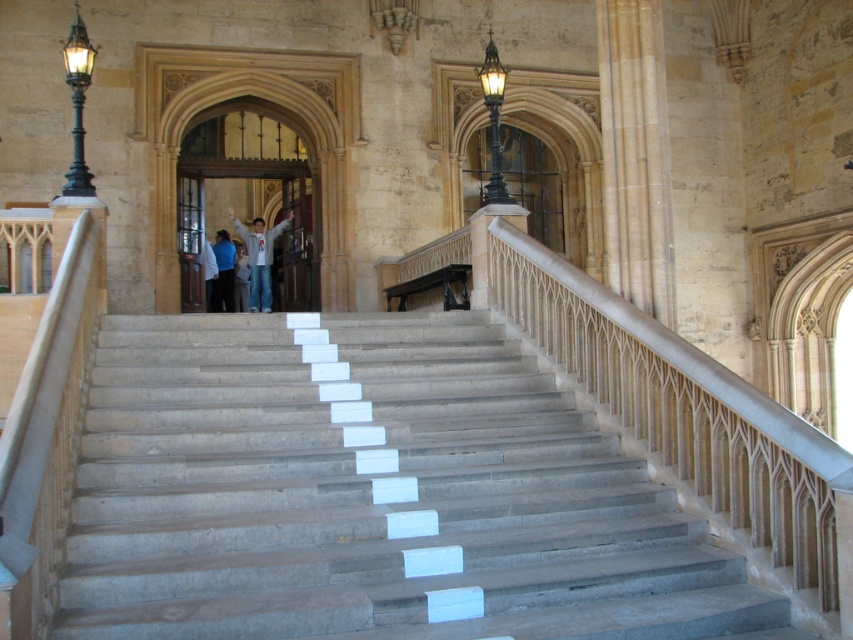
Between gray stone stairs at center and white cotton shirt at center, which one has less height?

gray stone stairs at center

How distant is gray stone stairs at center from white cotton shirt at center?

The distance of gray stone stairs at center from white cotton shirt at center is 63.31 feet.

This screenshot has height=640, width=853. What are the coordinates of `gray stone stairs at center` in the screenshot? It's located at (372, 493).

Does wooden balustrade at center have a greater height compared to blue shirt at center?

In fact, wooden balustrade at center may be shorter than blue shirt at center.

Between wooden balustrade at center and blue shirt at center, which one appears on the left side from the viewer's perspective?

Positioned to the left is blue shirt at center.

Does point (412, 289) lie behind point (224, 275)?

No, (412, 289) is closer to viewer.

Where is `wooden balustrade at center`? This screenshot has width=853, height=640. wooden balustrade at center is located at coordinates (433, 285).

From the picture: Is gray stone stairs at center above wooden balustrade at center?

No.

Which is in front, point (374, 444) or point (463, 292)?

Positioned in front is point (374, 444).

Does point (535, 528) come closer to viewer compared to point (448, 273)?

Yes, it is in front of point (448, 273).

At what (x,y) coordinates should I click in order to perform the action: click on gray stone stairs at center. Please return your answer as a coordinate pair (x, y). The width and height of the screenshot is (853, 640). Looking at the image, I should click on (372, 493).